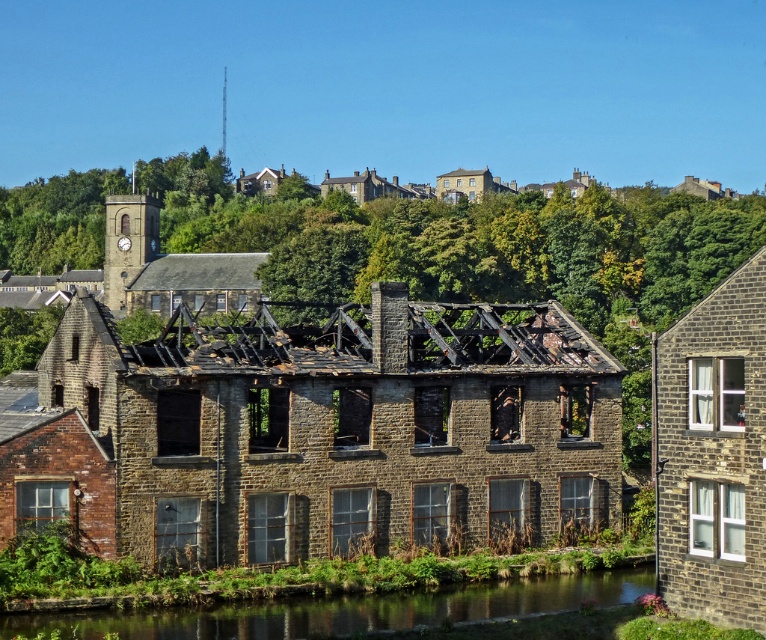
Question: Where is brown stone building at center located in relation to green grassy river at lower center in the image?

Choices:
 (A) left
 (B) right

Answer: (A)

Question: Can you confirm if brown stone building at center is positioned to the left of green grassy river at lower center?

Choices:
 (A) no
 (B) yes

Answer: (B)

Question: Considering the relative positions of brown stone building at center and green grassy river at lower center in the image provided, where is brown stone building at center located with respect to green grassy river at lower center?

Choices:
 (A) right
 (B) left

Answer: (B)

Question: Which point is farther to the camera?

Choices:
 (A) green grassy river at lower center
 (B) brown stone building at center

Answer: (B)

Question: Among these objects, which one is nearest to the camera?

Choices:
 (A) brown stone building at center
 (B) green grassy river at lower center

Answer: (B)